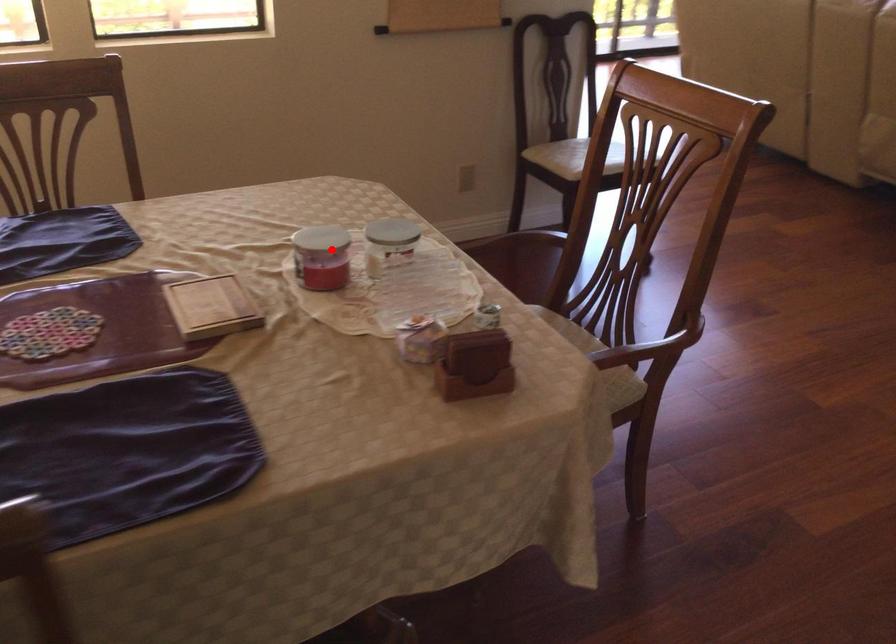
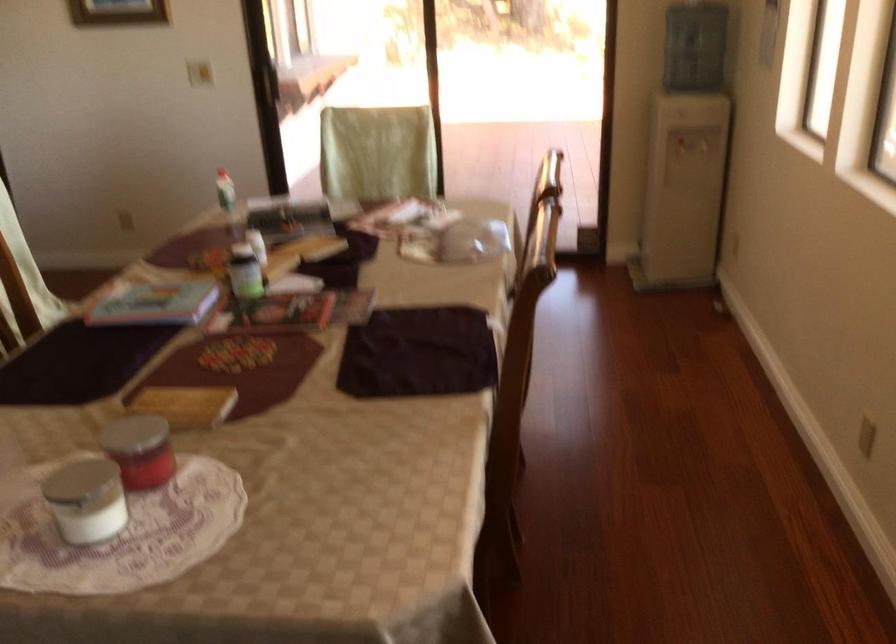
The point at the highlighted location is marked in the first image. Where is the corresponding point in the second image?

(149, 458)